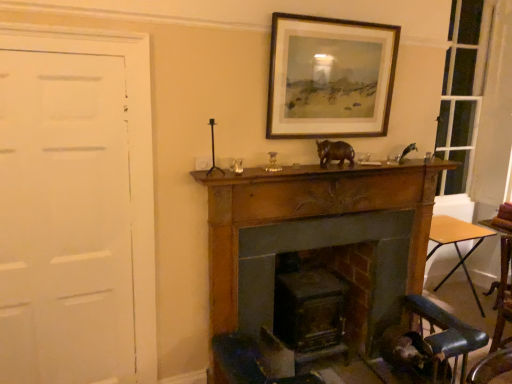
Question: From a real-world perspective, is metallic silver bird at upper right, arranged as the 2th animal when viewed from the left, on top of brown matte rhino at center, arranged as the first animal when viewed from the front?

Choices:
 (A) no
 (B) yes

Answer: (A)

Question: Does metallic silver bird at upper right, which is the 1th animal in back-to-front order, turn towards brown matte rhino at center, the second animal positioned from the back?

Choices:
 (A) no
 (B) yes

Answer: (A)

Question: Is metallic silver bird at upper right, arranged as the 2th animal when viewed from the left, smaller than brown matte rhino at center, acting as the 1th animal starting from the left?

Choices:
 (A) no
 (B) yes

Answer: (B)

Question: Is metallic silver bird at upper right, arranged as the 2th animal when viewed from the left, far away from brown matte rhino at center, arranged as the first animal when viewed from the front?

Choices:
 (A) yes
 (B) no

Answer: (B)

Question: From a real-world perspective, is metallic silver bird at upper right, which is the first animal from right to left, below brown matte rhino at center, the second animal positioned from the back?

Choices:
 (A) no
 (B) yes

Answer: (B)

Question: From the image's perspective, does metallic silver bird at upper right, arranged as the 2th animal when viewed from the left, appear lower than brown matte rhino at center, arranged as the first animal when viewed from the front?

Choices:
 (A) yes
 (B) no

Answer: (B)

Question: From the image's perspective, would you say white matte door at left is shown under smooth wood fireplace at center, which is the 2th fireplace in back-to-front order?

Choices:
 (A) no
 (B) yes

Answer: (A)

Question: Does white matte door at left have a greater width compared to smooth wood fireplace at center, which is the 2th fireplace in back-to-front order?

Choices:
 (A) yes
 (B) no

Answer: (B)

Question: Considering the relative sizes of white matte door at left and smooth wood fireplace at center, which appears as the first fireplace when viewed from the front, in the image provided, is white matte door at left bigger than smooth wood fireplace at center, which appears as the first fireplace when viewed from the front,?

Choices:
 (A) yes
 (B) no

Answer: (B)

Question: Can you confirm if white matte door at left is shorter than smooth wood fireplace at center, which appears as the first fireplace when viewed from the front?

Choices:
 (A) no
 (B) yes

Answer: (A)

Question: Is white matte door at left far away from smooth wood fireplace at center, which appears as the first fireplace when viewed from the front?

Choices:
 (A) no
 (B) yes

Answer: (A)

Question: Can you confirm if white matte door at left is thinner than smooth wood fireplace at center, which is the 2th fireplace in back-to-front order?

Choices:
 (A) no
 (B) yes

Answer: (B)

Question: Is white matte door at left thinner than dark gray stone fireplace at center, acting as the first fireplace starting from the back?

Choices:
 (A) yes
 (B) no

Answer: (A)